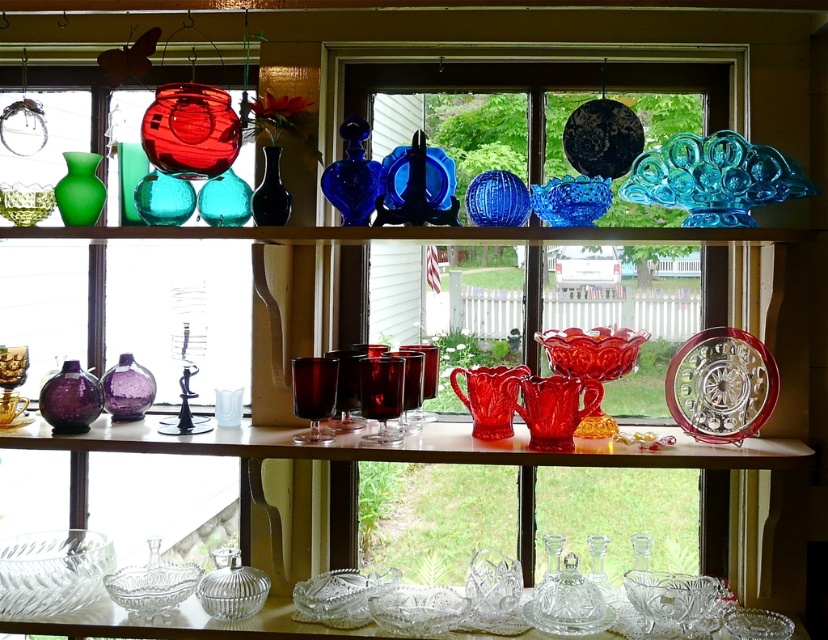
You are arranging a centerpiece for a dinner party and have two purple glass vases available. The first is the purple glass vase at lower left, and the second is the purple glass vase at center. Which of these vases would be more suitable for holding a larger bouquet of flowers?

The purple glass vase at lower left is wider than the purple glass vase at center, making it more suitable for holding a larger bouquet of flowers.

You are arranging flowers in the clear crystal bowl at center and the purple glass vase at center. Which object should you place flowers in first if you want the taller container to hold the taller flowers?

The clear crystal bowl at center is taller than the purple glass vase at center, so you should place flowers in the clear crystal bowl at center first to accommodate the taller flowers.

You are organizing a dinner party and need to choose between the clear crystal bowl at lower left and the clear crystal bowl at center for serving appetizers. Based on their sizes, which bowl would be more suitable for holding a larger quantity of food?

The clear crystal bowl at lower left is larger in size than the clear crystal bowl at center, making it more suitable for holding a larger quantity of food.